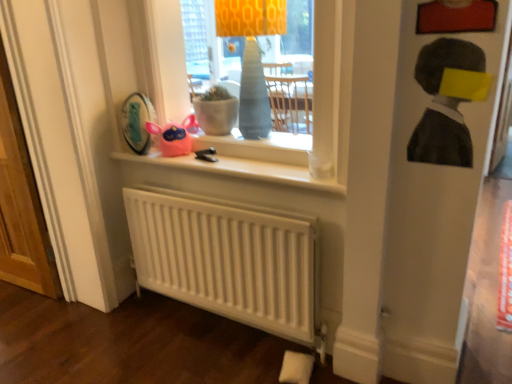
Question: Is point (180, 210) positioned closer to the camera than point (278, 177)?

Choices:
 (A) farther
 (B) closer

Answer: (A)

Question: From the image's perspective, is white matte radiator at lower center located above or below white matte window sill at upper center?

Choices:
 (A) below
 (B) above

Answer: (A)

Question: Which object is the closest to the white wooden screen door at left?

Choices:
 (A) matte glass vase at upper center
 (B) charcoal sketch portrait at upper right
 (C) white matte window sill at upper center
 (D) matte pink plush at upper center
 (E) white matte radiator at lower center

Answer: (C)

Question: Estimate the real-world distances between objects in this image. Which object is farther from the matte pink plush at upper center?

Choices:
 (A) matte glass vase at upper center
 (B) charcoal sketch portrait at upper right
 (C) white matte radiator at lower center
 (D) white wooden screen door at left
 (E) white matte window sill at upper center

Answer: (B)